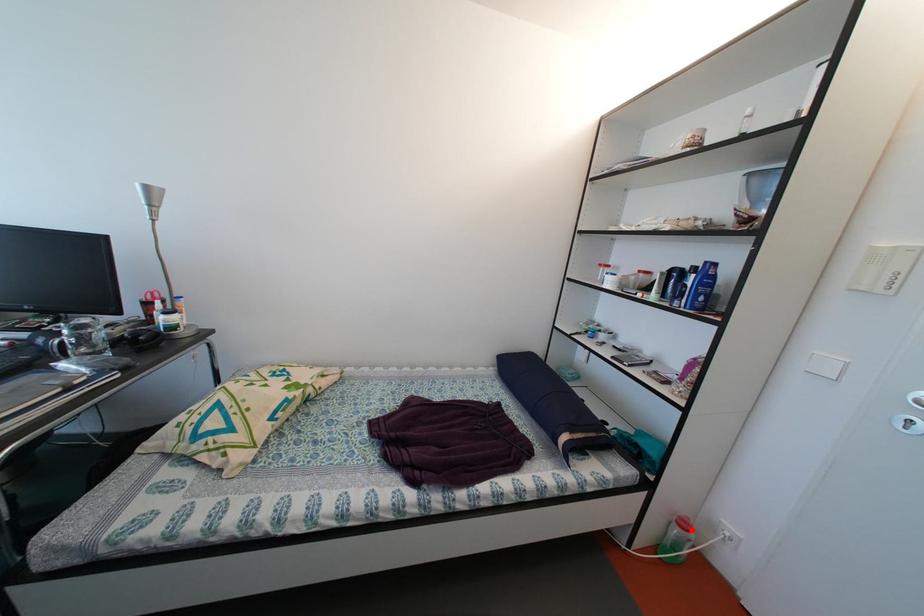
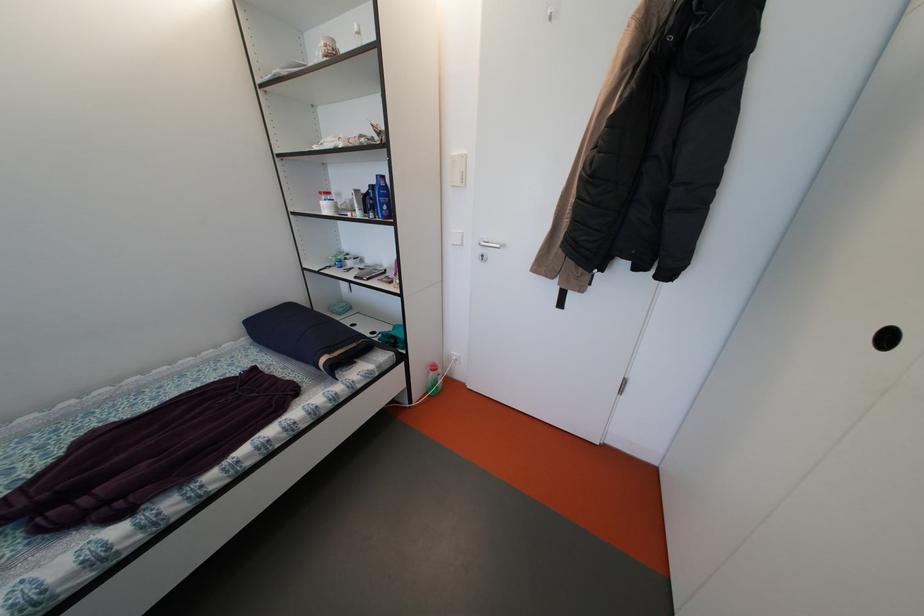
Question: I am providing you with two images of the same scene from different viewpoints. Image1 has a red point marked. In image2, the corresponding 3D location appears at what relative position? Reply with the corresponding letter.

Choices:
 (A) Closer
 (B) Farther

Answer: (B)